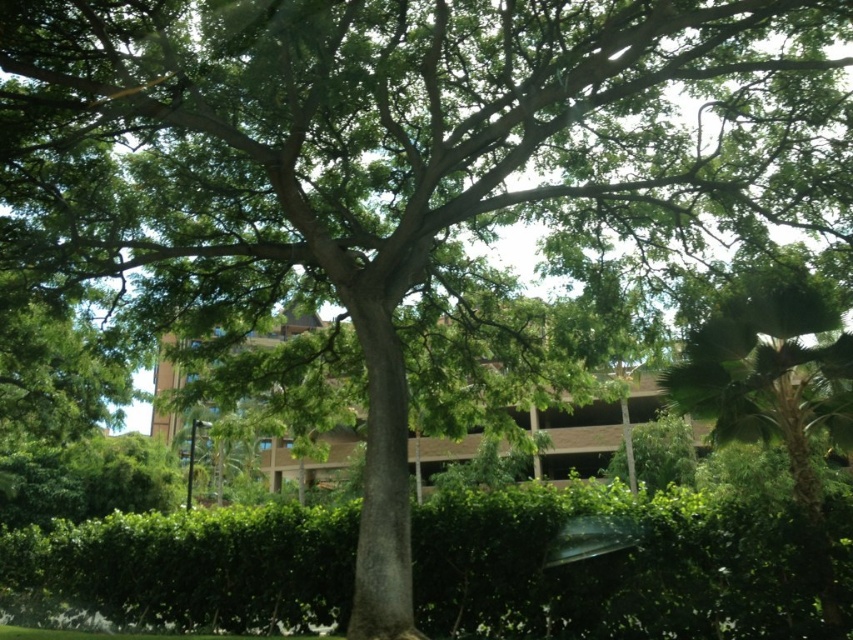
You are standing in the lush outdoor scene and want to walk towards the two points marked in the image. Which point, point (663, 513) or point (833, 355), will you reach first?

You will reach point (663, 513) first because it is closer to you than point (833, 355), which is further away.

You are a gardener planning to prune both the green leafy hedge at center and the green leafy palm at right. Based on their heights, which one will require a taller ladder?

The green leafy hedge at center is taller than the green leafy palm at right, so you will need a taller ladder for the green leafy hedge at center.